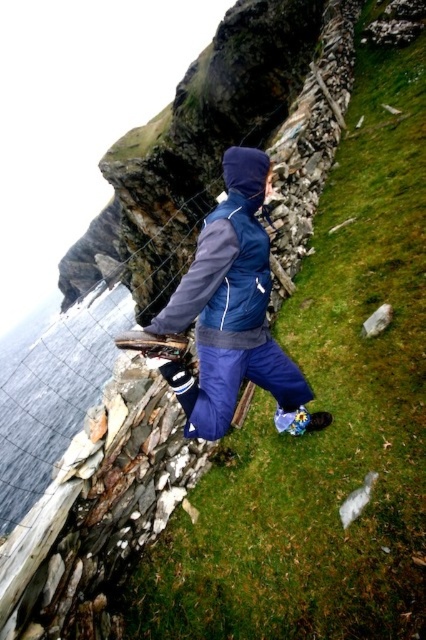
What are the coordinates of the blue fabric jacket at center in the image?

The coordinates of the blue fabric jacket at center are at point (232, 314).